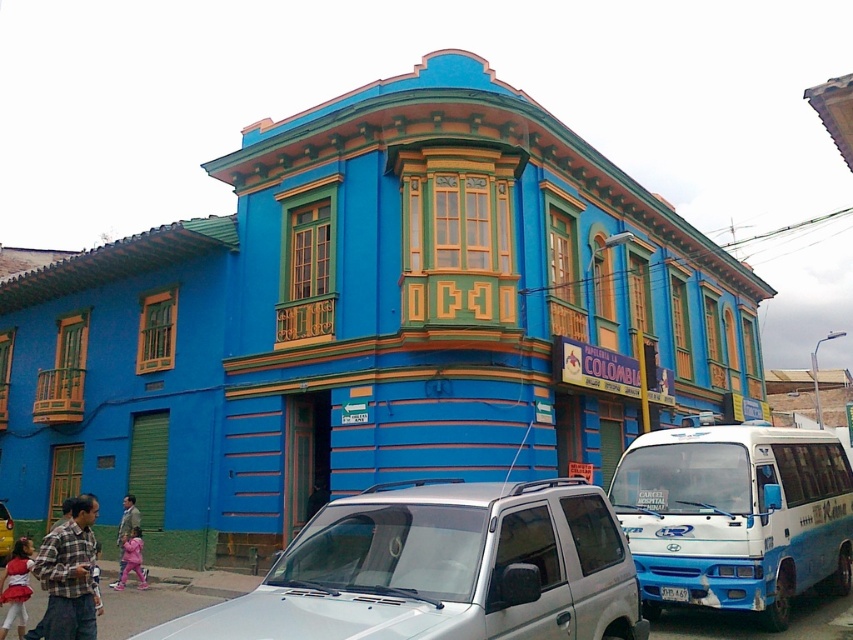
You are a tourist standing in front of the building and want to take a photo of the Colombia sign. There is a blue matte bus at lower right and a plaid fabric shirt at lower left in your view. Which object is larger in your current view?

The blue matte bus at lower right is bigger than the plaid fabric shirt at lower left, so the blue matte bus at lower right is larger in your current view.

You are a pedestrian standing in front of the building and want to cross the street. The metallic silver suv at center is blocking your view. Which direction should you look to see the blue matte bus at lower right without obstruction?

The blue matte bus at lower right is positioned on the right side of metallic silver suv at center, so you should look to the right of the metallic silver suv at center to see it without obstruction.